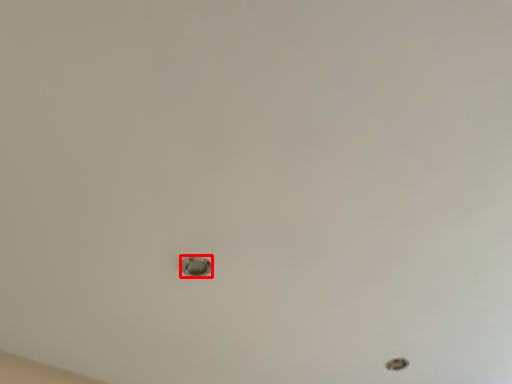
Question: From the image's perspective, what is the correct spatial positioning of knob (annotated by the red box) in reference to hole?

Choices:
 (A) above
 (B) below

Answer: (A)